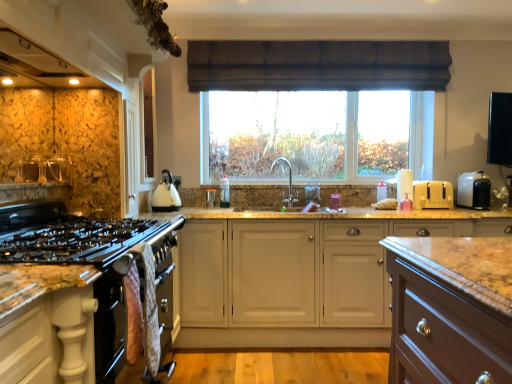
Where is `free spot in front of yellow plastic toaster at right, the 1th appliance when ordered from left to right`? The width and height of the screenshot is (512, 384). free spot in front of yellow plastic toaster at right, the 1th appliance when ordered from left to right is located at coordinates click(450, 210).